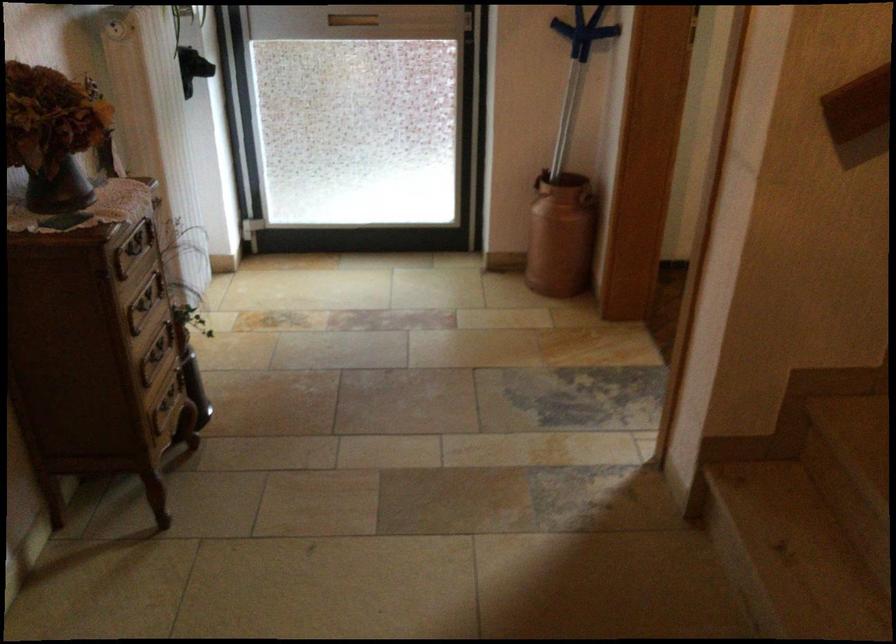
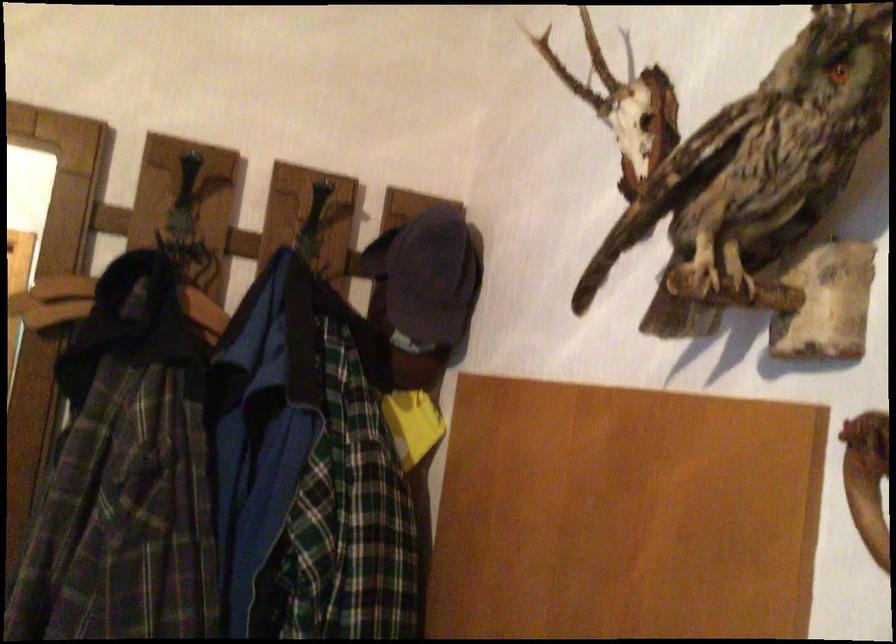
Question: The first image is from the beginning of the video and the second image is from the end. How did the camera likely rotate when shooting the video?

Choices:
 (A) Left
 (B) Right
 (C) Up
 (D) Down

Answer: (B)